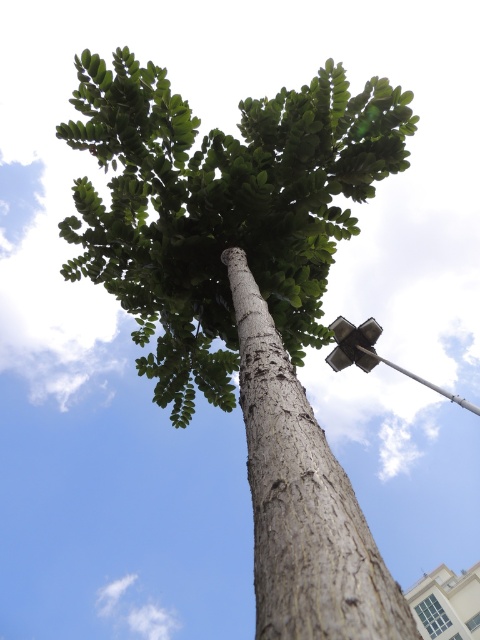
You are a city planner assessing the distance between the gray textured tree trunk at center and the metallic silver streetlight at upper right. The minimum required distance between trees and streetlights for safety is 8 meters. Is the current distance compliant with the safety standard?

The gray textured tree trunk at center and metallic silver streetlight at upper right are 7.54 meters apart, which is less than the required 8 meters. Therefore, the current distance does not comply with the safety standard.

You are standing in front of the tree and looking towards the streetlight. There are two points marked in the image. The first point is at coordinates point (167,177) and the second point is at coordinates point (375,333). Which point is closer to you?

Point (167,177) is closer to the camera than point (375,333).

You are a painter standing 3 meters away from the green rough bark tree at center. You want to paint the gray textured tree trunk at center as well. Can you reach both objects with your 2.5 meter long paintbrush without moving closer?

The distance between the green rough bark tree at center and the gray textured tree trunk at center is 2.25 meters. Since your paintbrush is 2.5 meters long, which is longer than the distance between them, you can reach both objects without moving closer.